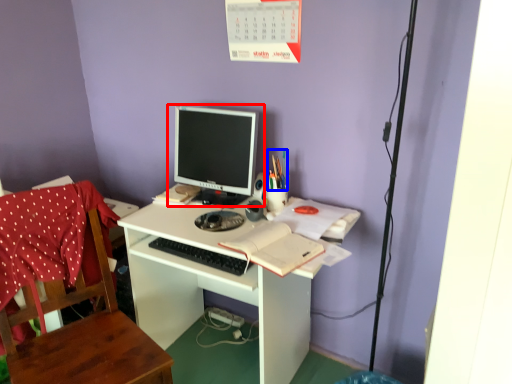
Question: Which point is further to the camera, computer monitor (highlighted by a red box) or stationery (highlighted by a blue box)?

Choices:
 (A) computer monitor
 (B) stationery

Answer: (B)